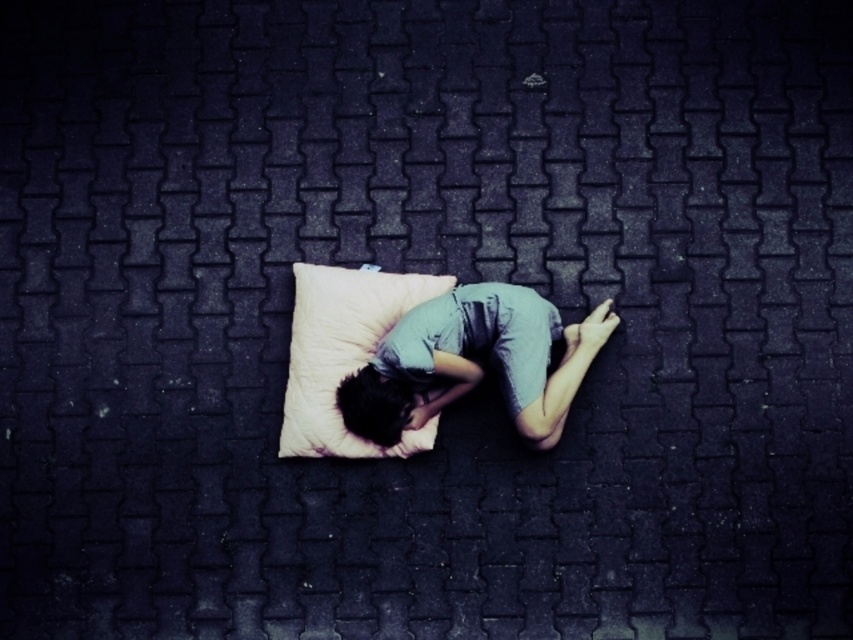
Does light blue fabric person at center appear on the left side of beige soft pillow at center?

In fact, light blue fabric person at center is to the right of beige soft pillow at center.

Who is more distant from viewer, (538,397) or (310,429)?

The point (310,429) is behind.

Which is behind, point (398, 353) or point (291, 323)?

The point (291, 323) is more distant.

Find the location of a particular element. The height and width of the screenshot is (640, 853). light blue fabric person at center is located at coordinates (474, 362).